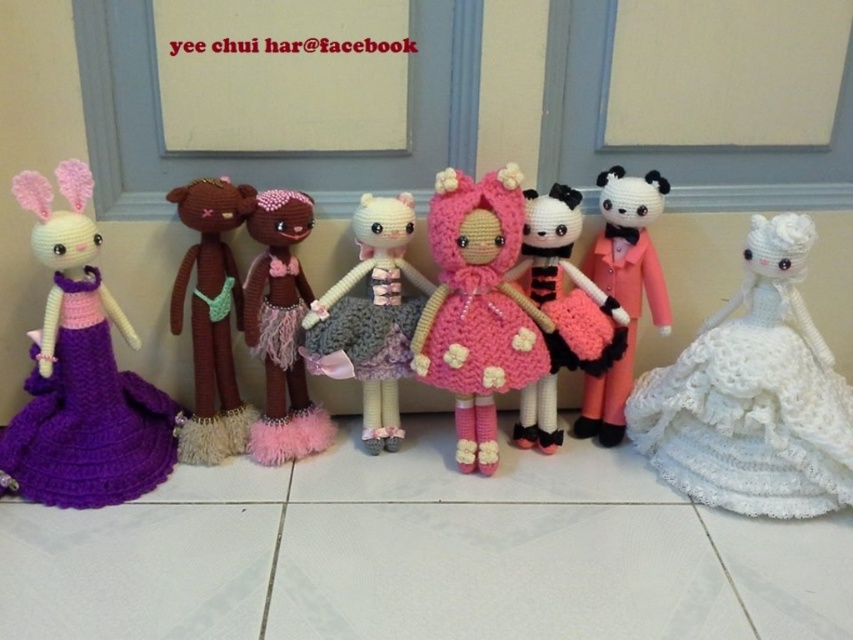
Question: Is brown yarn doll at center above panda doll at center?

Choices:
 (A) yes
 (B) no

Answer: (B)

Question: Which object is farther from the camera taking this photo?

Choices:
 (A) brown yarn teddy bear at center
 (B) purple crocheted dress at left

Answer: (A)

Question: In this image, where is white knitted dress at right located relative to pink crocheted dress at center?

Choices:
 (A) left
 (B) right

Answer: (B)

Question: Which object appears closest to the camera in this image?

Choices:
 (A) pink crocheted dress at center
 (B) panda doll at center
 (C) white knitted dress at right
 (D) purple crocheted dress at left

Answer: (C)

Question: Where is white knitted dress at right located in relation to brown yarn doll at center in the image?

Choices:
 (A) left
 (B) right

Answer: (B)

Question: Considering the real-world distances, which object is farthest from the brown yarn doll at center?

Choices:
 (A) purple crocheted dress at left
 (B) pink crocheted dress at center
 (C) white knitted dress at right

Answer: (C)